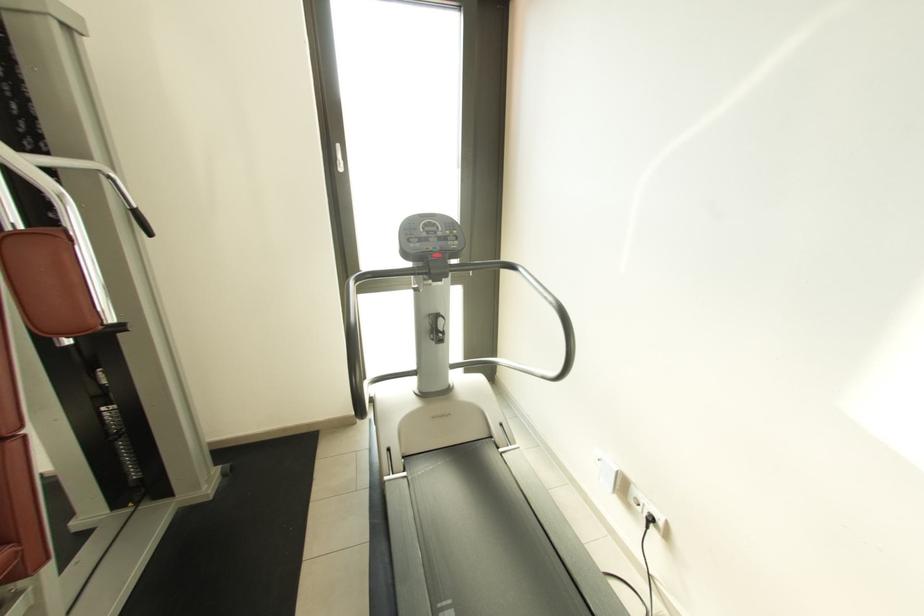
This screenshot has height=616, width=924. Describe the element at coordinates (47, 282) in the screenshot. I see `the brown padded armrest` at that location.